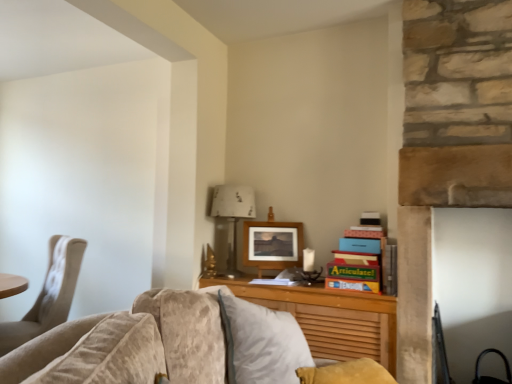
Question: Can you confirm if wooden at center is taller than wooden picture frame at center?

Choices:
 (A) yes
 (B) no

Answer: (A)

Question: Is wooden at center oriented towards wooden picture frame at center?

Choices:
 (A) yes
 (B) no

Answer: (B)

Question: From the image's perspective, is wooden at center below wooden picture frame at center?

Choices:
 (A) no
 (B) yes

Answer: (B)

Question: From the image's perspective, is wooden at center on wooden picture frame at center?

Choices:
 (A) yes
 (B) no

Answer: (B)

Question: Can you confirm if wooden at center is shorter than wooden picture frame at center?

Choices:
 (A) no
 (B) yes

Answer: (A)

Question: Is wooden at center thinner than wooden picture frame at center?

Choices:
 (A) yes
 (B) no

Answer: (B)

Question: Can you confirm if beige fabric chair at left is bigger than wooden at center?

Choices:
 (A) no
 (B) yes

Answer: (B)

Question: Does beige fabric chair at left have a greater height compared to wooden at center?

Choices:
 (A) no
 (B) yes

Answer: (B)

Question: Can you confirm if beige fabric chair at left is thinner than wooden at center?

Choices:
 (A) no
 (B) yes

Answer: (A)

Question: Are beige fabric chair at left and wooden at center making contact?

Choices:
 (A) yes
 (B) no

Answer: (B)

Question: Considering the relative sizes of beige fabric chair at left and wooden at center in the image provided, is beige fabric chair at left wider than wooden at center?

Choices:
 (A) no
 (B) yes

Answer: (B)

Question: Can you confirm if beige fabric chair at left is positioned to the left of wooden at center?

Choices:
 (A) no
 (B) yes

Answer: (B)

Question: Is wooden picture frame at center a part of beige fabric chair at left?

Choices:
 (A) no
 (B) yes

Answer: (A)